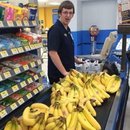
You are a GUI agent. You are given a task and a screenshot of the screen. Output one action in this format:
    pyautogui.click(x=<x>, y=<y>)
    Task: Click on the gumball machine
    
    Given the screenshot: What is the action you would take?
    pyautogui.click(x=93, y=32)